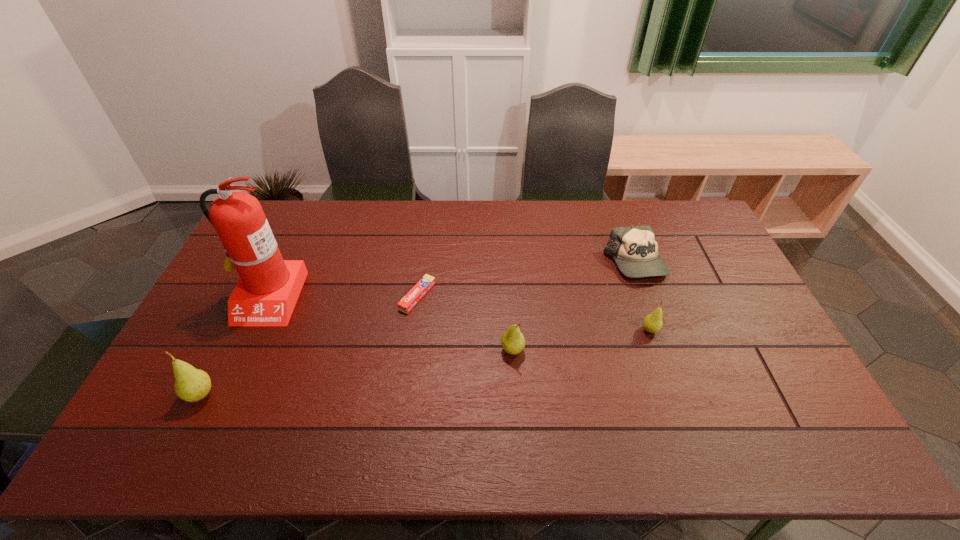
At what (x,y) coordinates should I click in order to perform the action: click on free space that is in between the second tallest pear and the third shortest object. Please return your answer as a coordinate pair (x, y). The width and height of the screenshot is (960, 540). Looking at the image, I should click on (581, 340).

I want to click on free space that is in between the fourth object from right to left and the fourth object from left to right, so click(x=465, y=323).

What are the coordinates of `blank region between the baseball cap and the fire extinguisher` in the screenshot? It's located at pos(450,280).

Identify the location of vacant space that's between the baseball cap and the rightmost pear. point(642,296).

The height and width of the screenshot is (540, 960). Identify the location of free space between the second nearest object and the shortest object. (465, 323).

Identify the location of the closest object to the fire extinguisher. (191, 384).

This screenshot has width=960, height=540. Find the location of `object that stands as the fourth closest to the tallest object`. object that stands as the fourth closest to the tallest object is located at coordinates (635, 250).

Identify which pear is the second closest to the tallest object. Please provide its 2D coordinates. Your answer should be formatted as a tuple, i.e. [(x, y)], where the tuple contains the x and y coordinates of a point satisfying the conditions above.

[(513, 342)]

This screenshot has height=540, width=960. What are the coordinates of `the second closest pear to the second pear from left to right` in the screenshot? It's located at (191, 384).

You are a GUI agent. You are given a task and a screenshot of the screen. Output one action in this format:
    pyautogui.click(x=<x>, y=<y>)
    Task: Click on the vacant space that satisfies the following two spatial constraints: 1. on the front side of the third object from left to right; 2. on the right side of the third object from right to left
    
    Given the screenshot: What is the action you would take?
    pyautogui.click(x=410, y=350)